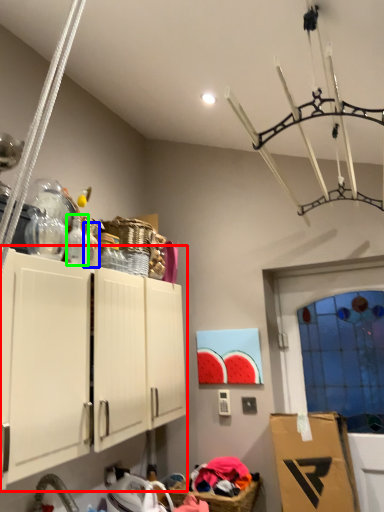
Question: Based on their relative distances, which object is nearer to cabinetry (highlighted by a red box)? Choose from bottle (highlighted by a blue box) and bottle (highlighted by a green box).

Choices:
 (A) bottle
 (B) bottle

Answer: (B)